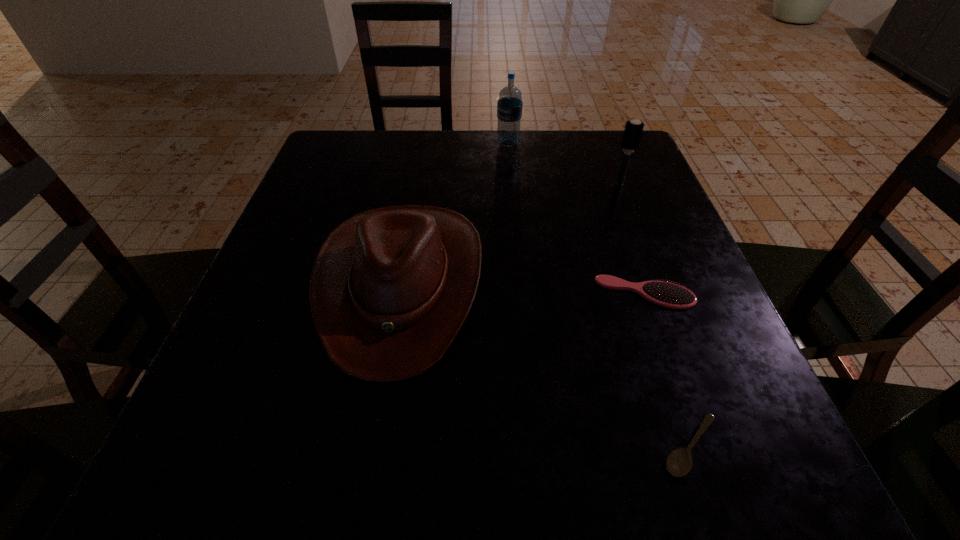
The image size is (960, 540). Find the location of `object present at the far right corner`. object present at the far right corner is located at coordinates (633, 130).

Identify the location of object present at the near right corner. The width and height of the screenshot is (960, 540). (679, 462).

The height and width of the screenshot is (540, 960). In the image, there is a desktop. Find the location of `free region at the far edge`. free region at the far edge is located at coordinates (467, 160).

Find the location of `vacant space at the near edge`. vacant space at the near edge is located at coordinates (499, 438).

In the image, there is a desktop. In order to click on vacant space at the left edge in this screenshot , I will do `click(268, 275)`.

Locate an element on the screen. This screenshot has height=540, width=960. free space at the right edge is located at coordinates (604, 210).

You are a GUI agent. You are given a task and a screenshot of the screen. Output one action in this format:
    pyautogui.click(x=<x>, y=<y>)
    Task: Click on the free space at the far left corner of the desktop
    This screenshot has height=540, width=960.
    Given the screenshot: What is the action you would take?
    pyautogui.click(x=347, y=164)

In the image, there is a desktop. In order to click on free space at the far right corner in this screenshot , I will do `click(635, 180)`.

Where is `empty space that is in between the cowboy hat and the nearer hairbrush`? This screenshot has height=540, width=960. empty space that is in between the cowboy hat and the nearer hairbrush is located at coordinates (523, 288).

I want to click on vacant space in between the shorter hairbrush and the nearest object, so click(667, 369).